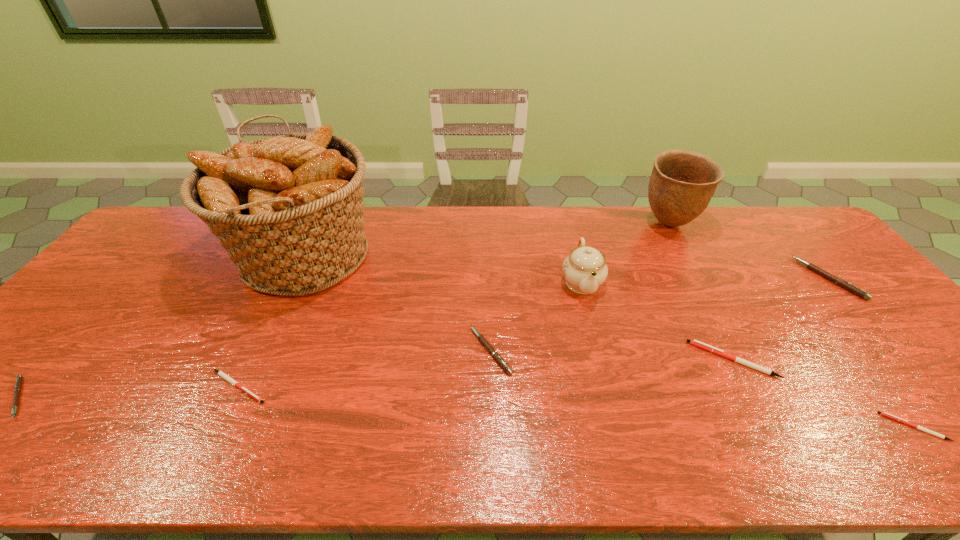
What are the coordinates of `free spot between the farthest pen and the second white pen from right to left` in the screenshot? It's located at [780, 319].

Where is `vacant area that lies between the second tallest object and the biggest white pen`? The width and height of the screenshot is (960, 540). vacant area that lies between the second tallest object and the biggest white pen is located at coordinates (701, 292).

Image resolution: width=960 pixels, height=540 pixels. I want to click on free area in between the leftmost white pen and the third tallest object, so click(410, 334).

The width and height of the screenshot is (960, 540). Identify the location of free space between the pottery and the rightmost pink pen. (748, 251).

This screenshot has height=540, width=960. I want to click on free area in between the farthest pink pen and the rightmost white pen, so click(x=871, y=353).

I want to click on vacant space in between the leftmost white pen and the tallest pen, so click(533, 333).

Locate which object is the seventh closest to the fifth pen from right to left. Please provide its 2D coordinates. Your answer should be formatted as a tuple, i.e. [(x, y)], where the tuple contains the x and y coordinates of a point satisfying the conditions above.

[(885, 414)]

Find the location of a particular element. the sixth closest object to the smallest pink pen is located at coordinates (682, 183).

This screenshot has height=540, width=960. In order to click on pen that is the third closest to the second tallest object in this screenshot , I will do `click(495, 354)`.

Find the location of a particular element. The height and width of the screenshot is (540, 960). the fifth closest pen to the smallest white pen is located at coordinates (18, 384).